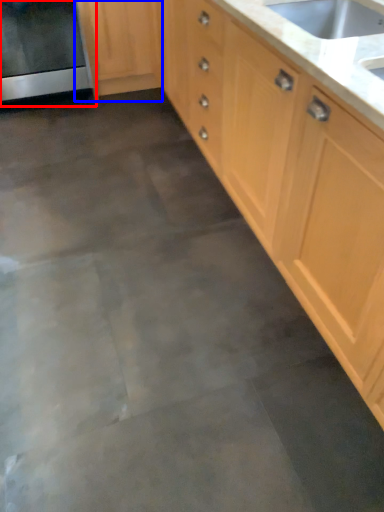
Question: Which object appears farthest to the camera in this image, oven (highlighted by a red box) or cabinetry (highlighted by a blue box)?

Choices:
 (A) oven
 (B) cabinetry

Answer: (B)